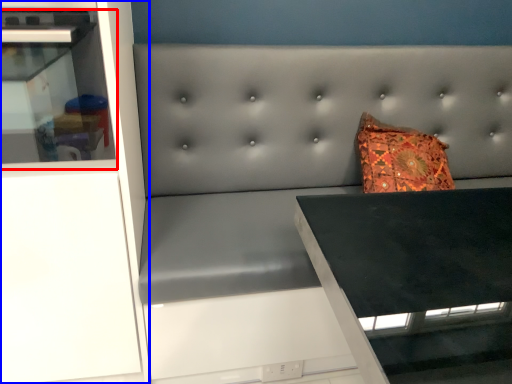
Question: Which object is closer to the camera taking this photo, shelf (highlighted by a red box) or cabinetry (highlighted by a blue box)?

Choices:
 (A) shelf
 (B) cabinetry

Answer: (A)